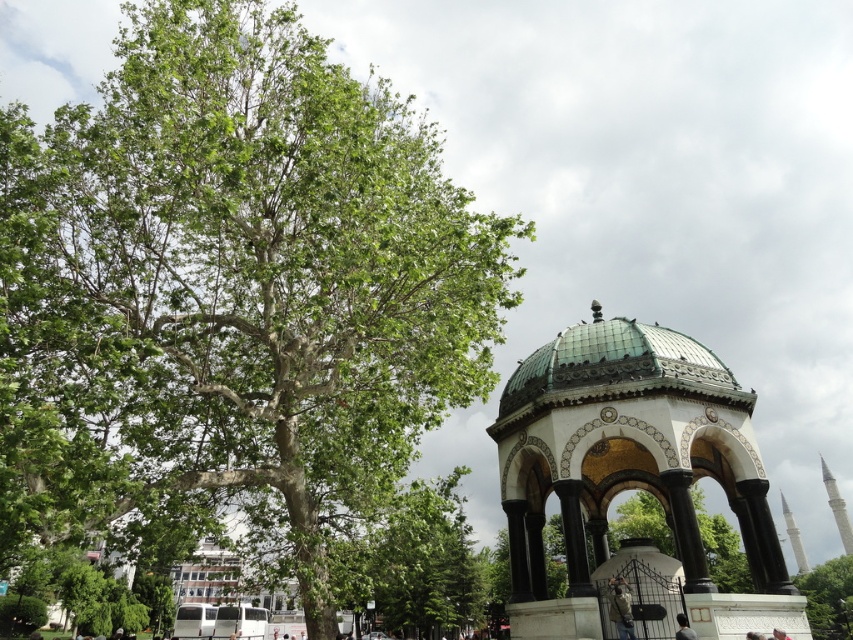
Is green-tiled gazebo at center positioned at the back of green leafy tree at center?

No, green-tiled gazebo at center is closer to the viewer.

Is point (664, 436) positioned before point (840, 579)?

Yes, point (664, 436) is in front of point (840, 579).

Where is `green-tiled gazebo at center`? The image size is (853, 640). green-tiled gazebo at center is located at coordinates (630, 468).

Who is higher up, green leafy tree at left or green leafy tree at center?

green leafy tree at left

Between green leafy tree at left and green leafy tree at center, which one has more height?

With more height is green leafy tree at left.

Locate an element on the screen. The height and width of the screenshot is (640, 853). green leafy tree at left is located at coordinates 231,292.

In order to click on green leafy tree at left in this screenshot , I will do `click(231, 292)`.

Can you confirm if khaki fabric jacket at lower right is positioned to the left of gray fabric person at lower center?

Yes, khaki fabric jacket at lower right is to the left of gray fabric person at lower center.

Does khaki fabric jacket at lower right have a greater height compared to gray fabric person at lower center?

Yes.

Describe the element at coordinates (619, 609) in the screenshot. I see `khaki fabric jacket at lower right` at that location.

Identify the location of khaki fabric jacket at lower right. (619, 609).